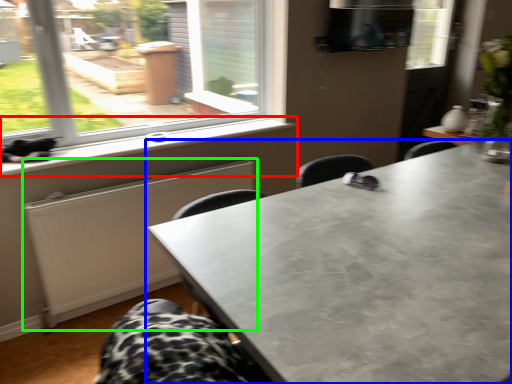
Question: Considering the real-world distances, which object is farthest from window sill (highlighted by a red box)? table (highlighted by a blue box) or radiator (highlighted by a green box)?

Choices:
 (A) table
 (B) radiator

Answer: (A)